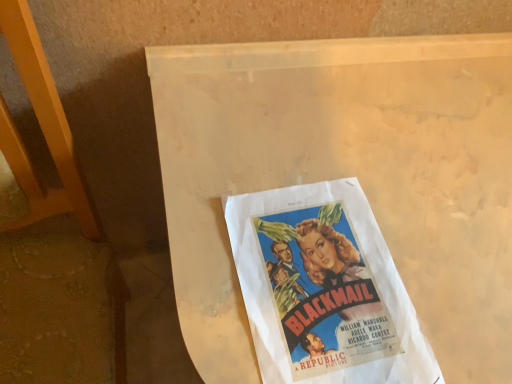
Find the location of a particular element. The height and width of the screenshot is (384, 512). vacant area on the back side of vintage paper poster at center is located at coordinates (338, 147).